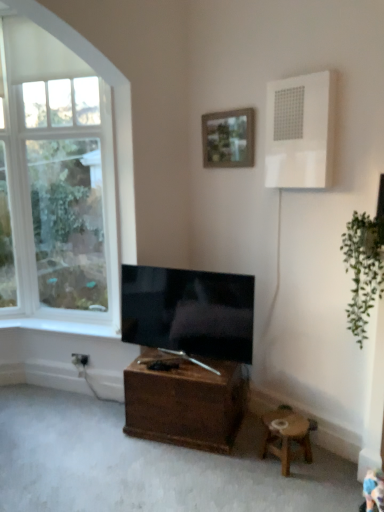
In order to click on vacant area on top of white smooth window sill at lower left (from a real-world perspective) in this screenshot , I will do `click(60, 325)`.